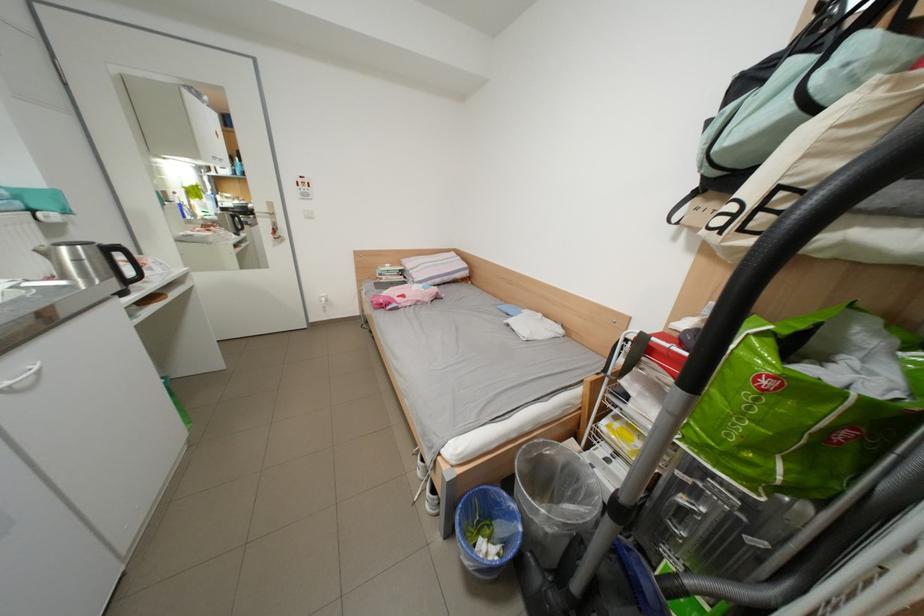
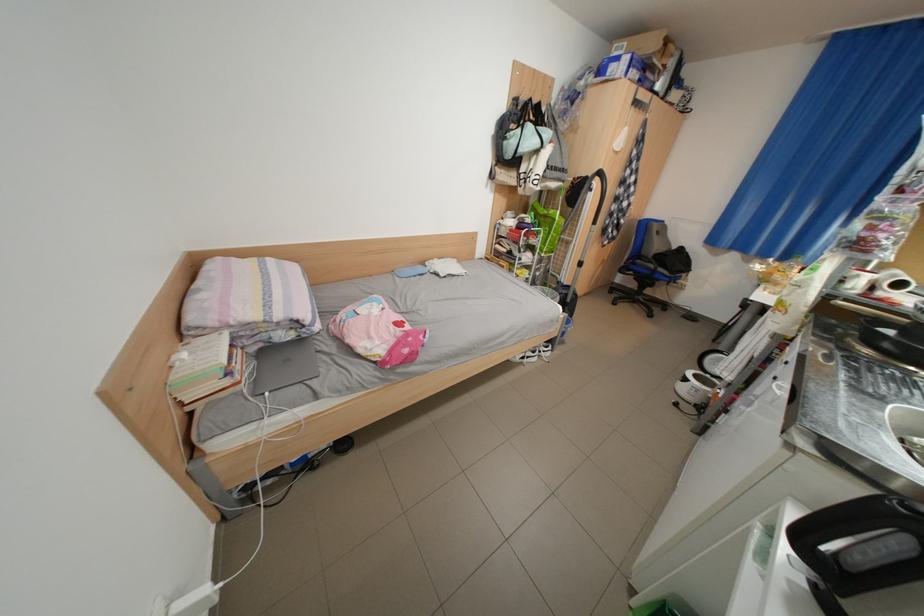
Find the pixel in the second image that matches (x=801, y=111) in the first image.

(552, 147)